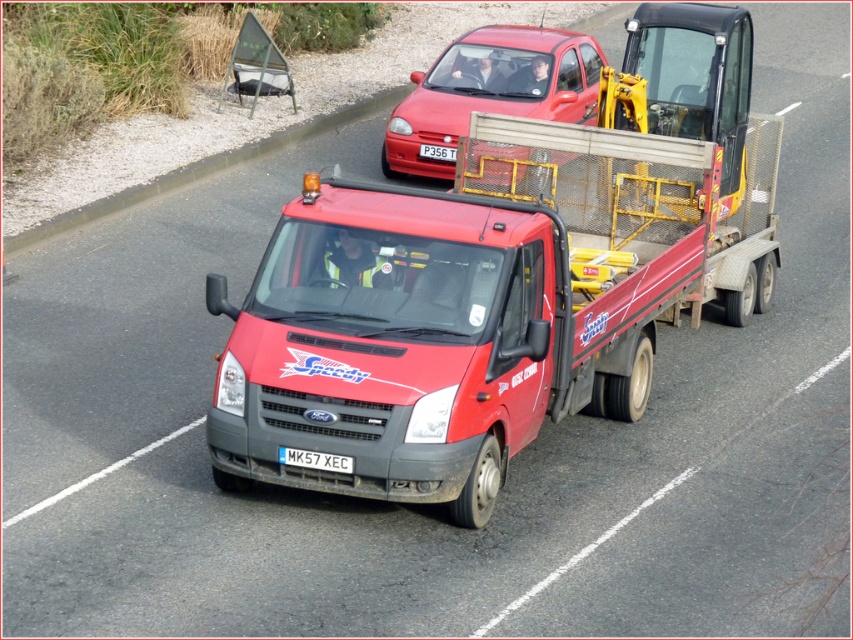
Question: Which point is closer to the camera taking this photo?

Choices:
 (A) (413, 268)
 (B) (505, 112)

Answer: (A)

Question: Estimate the real-world distances between objects in this image. Which object is closer to the metallic red hatchback at upper center?

Choices:
 (A) white plastic license plate at center
 (B) red plastic license plate at center
 (C) matte red tow truck at center

Answer: (B)

Question: Does matte red tow truck at center have a lesser width compared to white plastic license plate at center?

Choices:
 (A) no
 (B) yes

Answer: (B)

Question: Which point appears farthest from the camera in this image?

Choices:
 (A) (451, 156)
 (B) (350, 467)
 (C) (444, 134)
 (D) (679, 70)

Answer: (A)

Question: Considering the relative positions of metallic red hatchback at upper center and white plastic license plate at center in the image provided, where is metallic red hatchback at upper center located with respect to white plastic license plate at center?

Choices:
 (A) above
 (B) below

Answer: (A)

Question: Observing the image, what is the correct spatial positioning of metallic red hatchback at upper center in reference to white plastic license plate at center?

Choices:
 (A) above
 (B) below

Answer: (A)